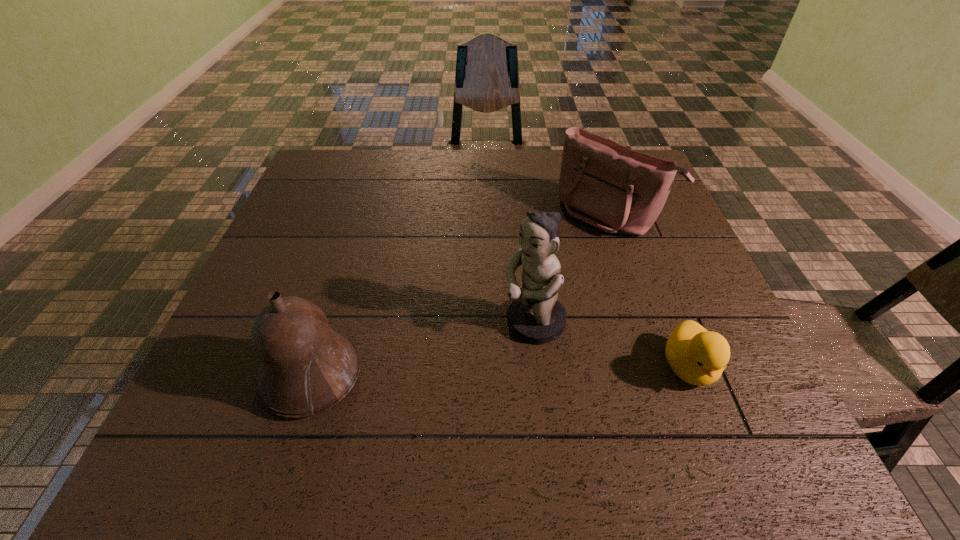
Locate an element on the screen. vacant space on the desktop that is between the leftmost object and the duck and is positioned on the front pocket of the farthest object is located at coordinates (445, 373).

The height and width of the screenshot is (540, 960). I want to click on free space on the desktop that is between the bell and the shortest object and is positioned on the front-facing side of the figurine, so click(x=446, y=373).